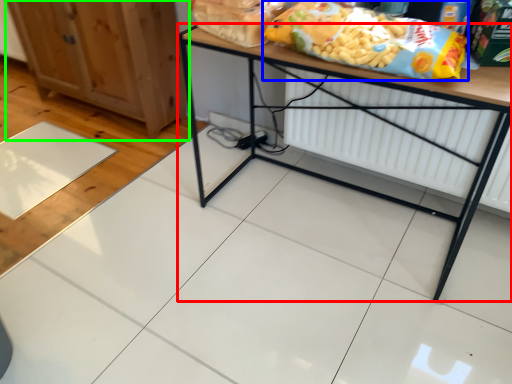
Question: Which object is positioned closest to table (highlighted by a red box)? Select from cereal (highlighted by a blue box) and cabinetry (highlighted by a green box).

Choices:
 (A) cereal
 (B) cabinetry

Answer: (A)